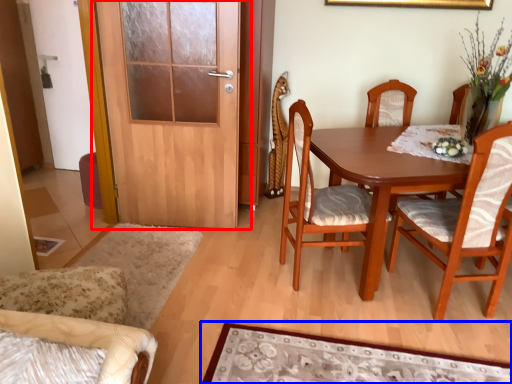
Question: Which point is further to the camera, door (highlighted by a red box) or mat (highlighted by a blue box)?

Choices:
 (A) door
 (B) mat

Answer: (A)